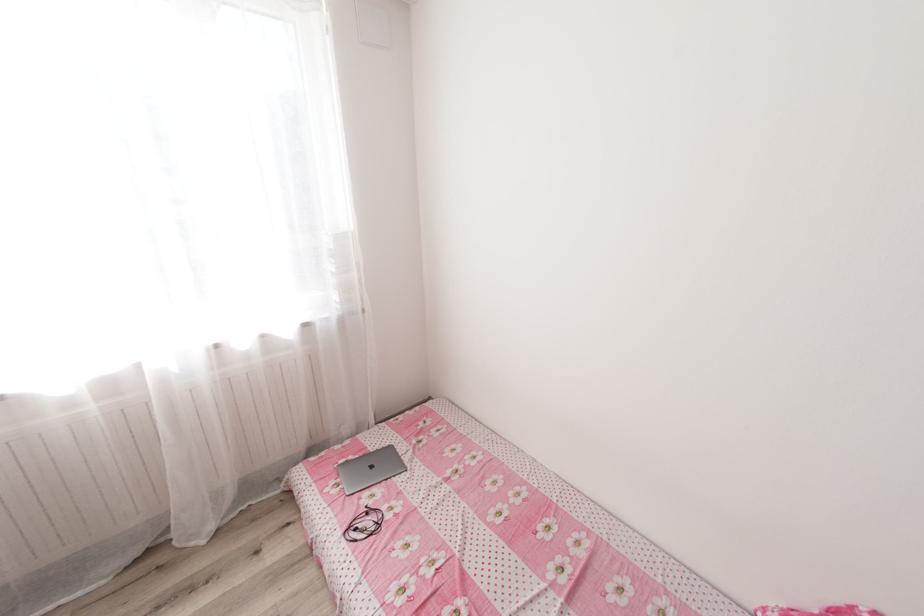
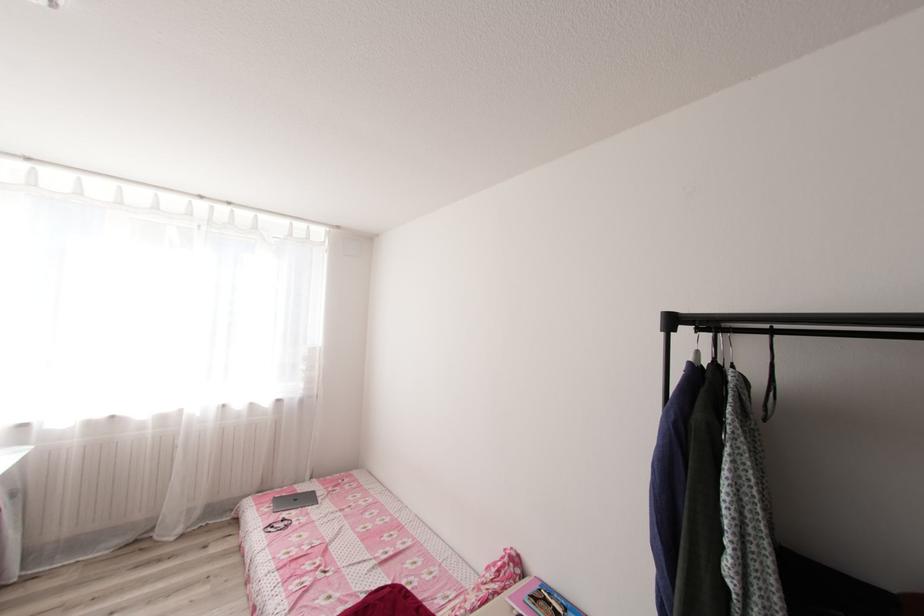
Locate, in the second image, the point that corresponds to point (373, 522) in the first image.

(286, 525)